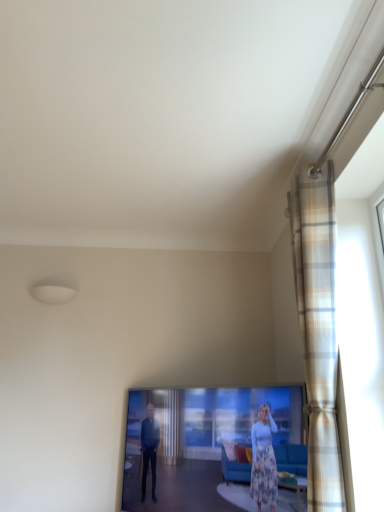
Looking at this image, measure the distance between plaid fabric curtain at right and camera.

plaid fabric curtain at right is 4.91 feet from camera.

The image size is (384, 512). What do you see at coordinates (318, 330) in the screenshot?
I see `plaid fabric curtain at right` at bounding box center [318, 330].

The height and width of the screenshot is (512, 384). Find the location of `plaid fabric curtain at right`. plaid fabric curtain at right is located at coordinates (318, 330).

What are the coordinates of `plaid fabric curtain at right` in the screenshot? It's located at (318, 330).